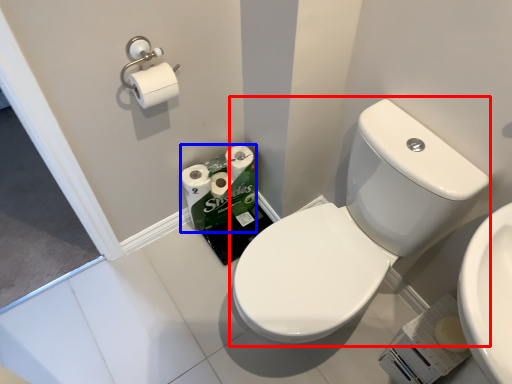
Question: Which point is closer to the camera, sink (highlighted by a red box) or toilet paper (highlighted by a blue box)?

Choices:
 (A) sink
 (B) toilet paper

Answer: (A)